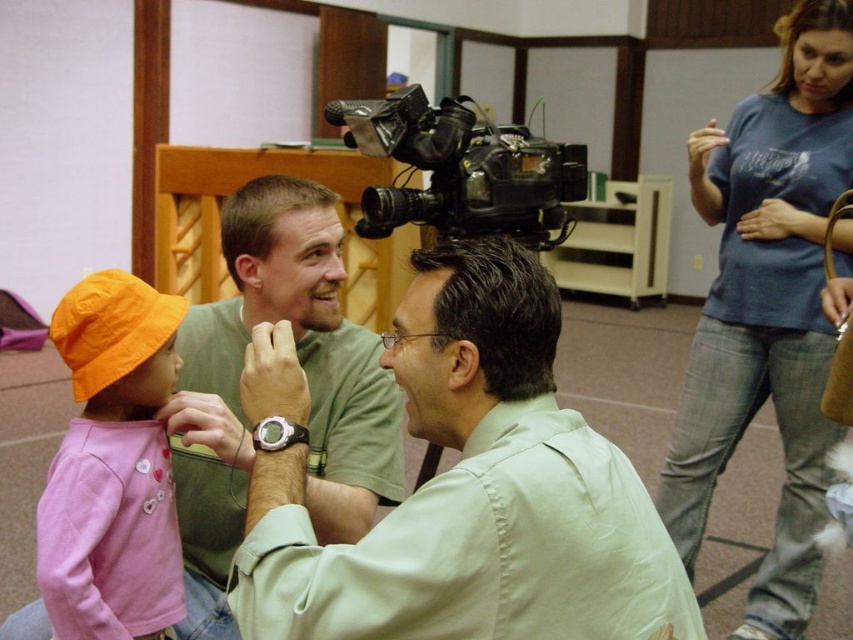
Looking at this image, based on the coordinates provided in the scene, where exactly is the light green shirt at center located?

The light green shirt at center is located at point 0.769 along the x axis and 0.555 along the y axis.

You are at an event and need to locate two men wearing green shirts. The scene has a light green shirt at center and a matte green shirt at center. Which one is positioned lower in the image?

The light green shirt at center is located below matte green shirt at center, so the light green shirt at center is positioned lower in the image.

Consider the image. You are a photographer at an event and need to adjust the camera height to focus on the light green shirt at center and the matte green shirt at center. Which shirt should you lower the camera to focus on?

The light green shirt at center is shorter than the matte green shirt at center, so you should lower the camera to focus on the light green shirt at center.